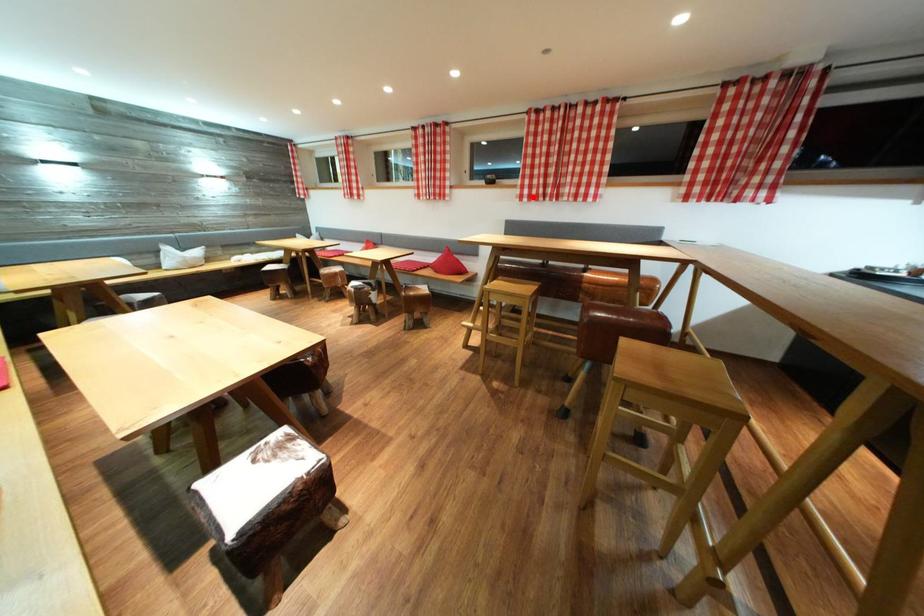
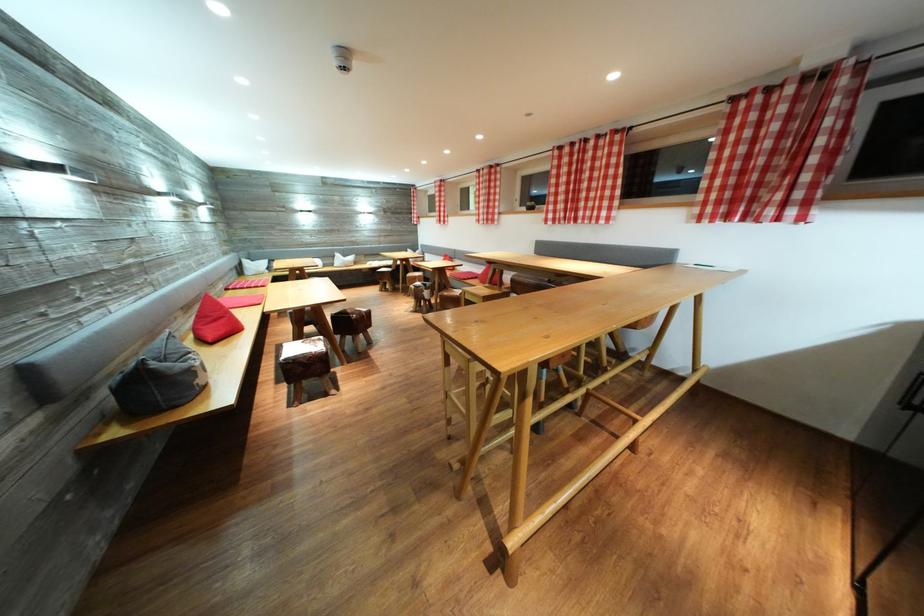
Where in the second image is the point corresponding to the highlighted location from the first image?

(556, 222)